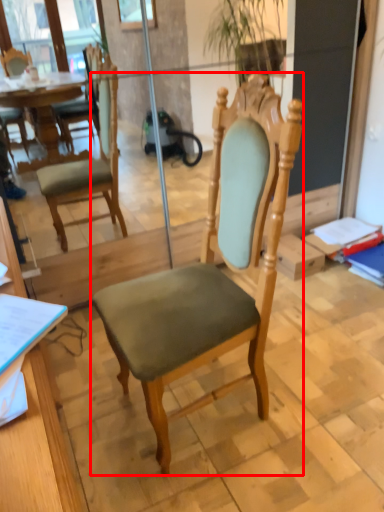
Question: From the image's perspective, considering the relative positions of chair (annotated by the red box) and desk in the image provided, where is chair (annotated by the red box) located with respect to the staircase?

Choices:
 (A) below
 (B) above

Answer: (B)